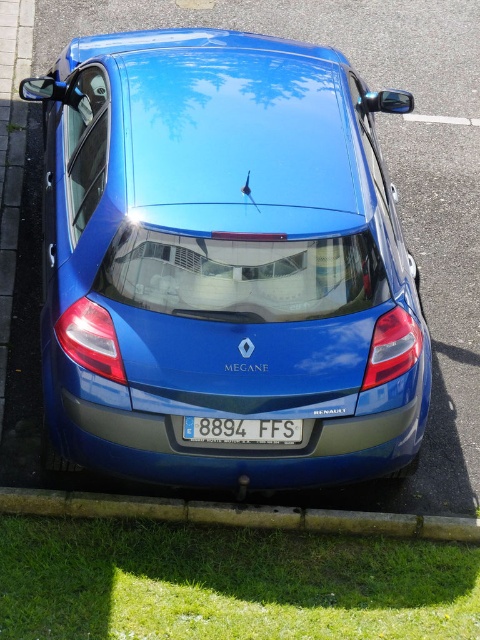
You are a delivery driver who needs to park your vehicle in a spot that requires at least 6 feet of clearance between your car and any nearby obstacles. Based on the scene described, will the glossy blue car at center have enough space from the green grass at lower left?

The glossy blue car at center is 5.86 feet away from the green grass at lower left. Since the required clearance is 6 feet, the distance is insufficient. Therefore, the glossy blue car at center does not have enough space from the green grass at lower left.

You are a drone operator trying to capture a photo of the glossy blue car at center and the green grass at lower center. From your current position, you need to ensure both objects are fully visible in the frame. Given their widths, which object should you prioritize keeping centered to avoid cropping?

The glossy blue car at center is thinner than the green grass at lower center, so you should prioritize keeping the green grass at lower center centered to avoid cropping since it is wider.

You are a drone operator trying to capture aerial footage of the glossy blue car at center and the green grass at lower left. From your current position above the scene, which object is located higher in the image?

The glossy blue car at center is located higher than the green grass at lower left in the image.